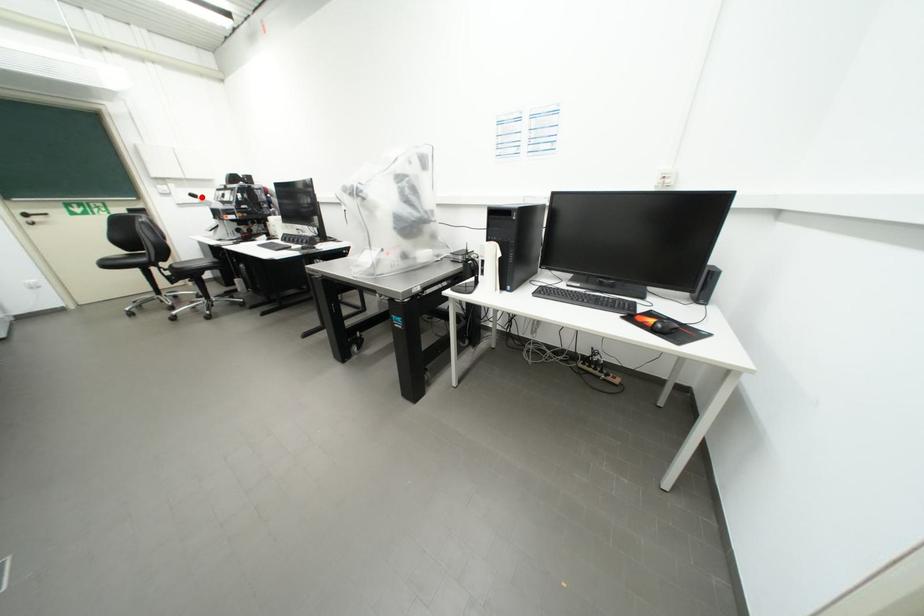
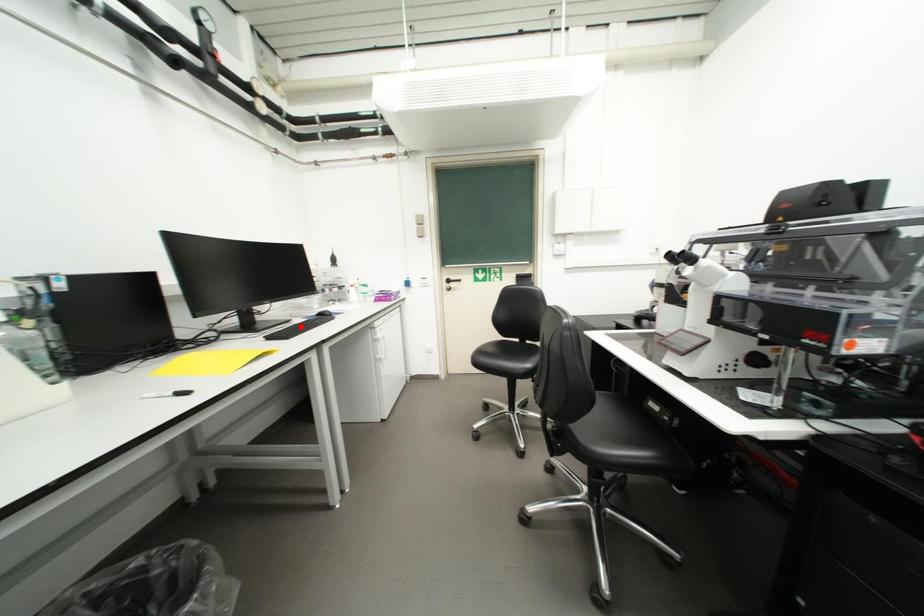
I am providing you with two images of the same scene from different viewpoints. A red point is marked on the first image and another point is marked on the second image. Does the point marked in image1 correspond to the same location as the one in image2?

No